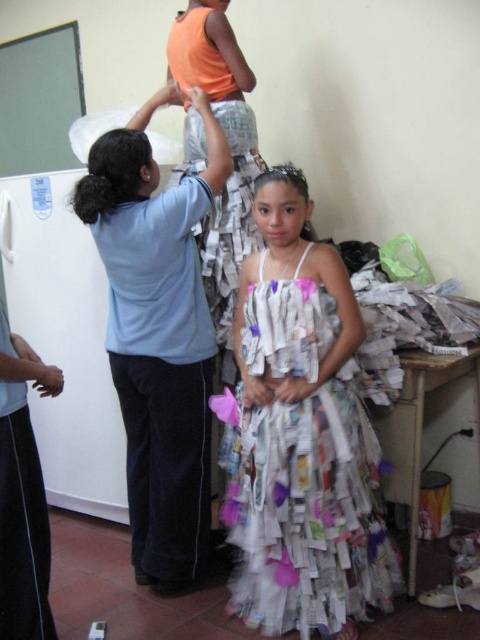
Question: Which object is farther from the camera taking this photo?

Choices:
 (A) recycled paper dress at center
 (B) matte blue shirt at upper left

Answer: (B)

Question: Which point appears closest to the camera in this image?

Choices:
 (A) click(x=308, y=477)
 (B) click(x=169, y=369)

Answer: (A)

Question: Among these objects, which one is nearest to the camera?

Choices:
 (A) matte blue shirt at upper left
 (B) recycled paper dress at center

Answer: (B)

Question: Can you confirm if recycled paper dress at center is positioned above matte blue shirt at upper left?

Choices:
 (A) no
 (B) yes

Answer: (A)

Question: Can you confirm if recycled paper dress at center is positioned above matte blue shirt at upper left?

Choices:
 (A) yes
 (B) no

Answer: (B)

Question: Does recycled paper dress at center have a smaller size compared to matte blue shirt at upper left?

Choices:
 (A) no
 (B) yes

Answer: (B)